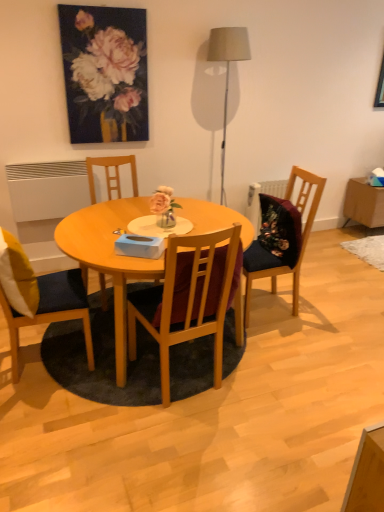
You are a GUI agent. You are given a task and a screenshot of the screen. Output one action in this format:
    pyautogui.click(x=<x>, y=<y>)
    Task: Click on the vacant space in front of dark blue fabric chair at center, acting as the first chair starting from the right
    This screenshot has height=512, width=384.
    Given the screenshot: What is the action you would take?
    pyautogui.click(x=305, y=338)